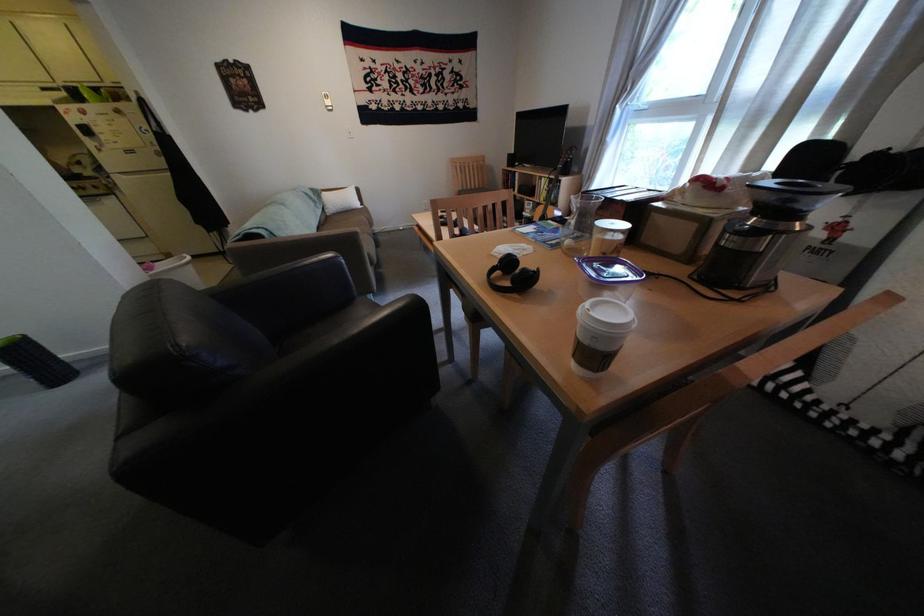
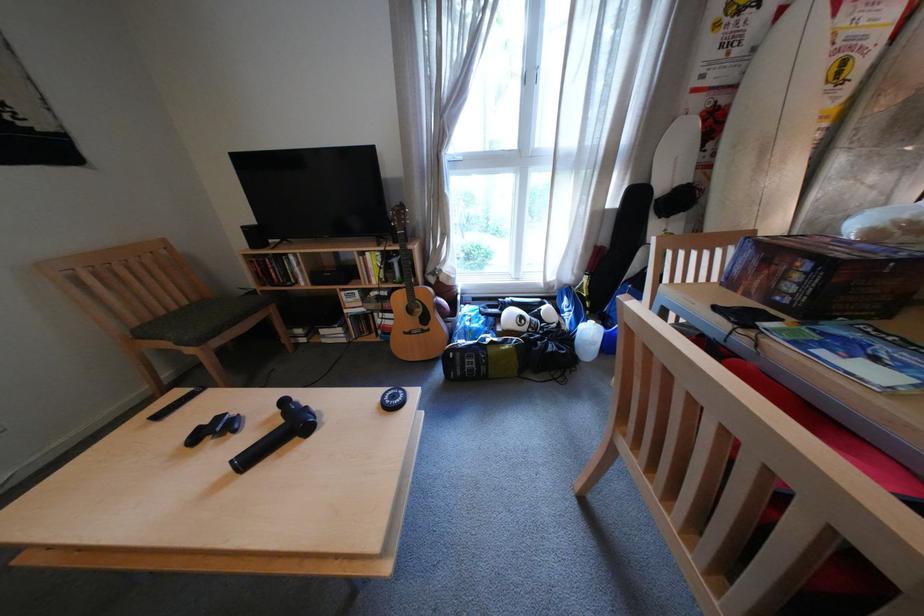
The point at (491, 188) is marked in the first image. Where is the corresponding point in the second image?

(199, 304)